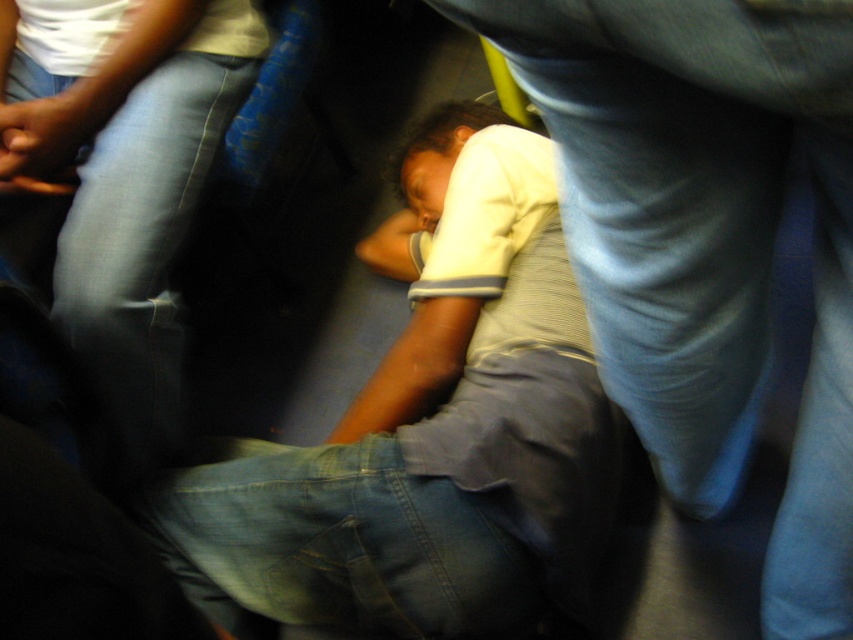
Question: Does white cotton shirt at center have a greater width compared to gray striped shirt at center?

Choices:
 (A) yes
 (B) no

Answer: (A)

Question: Does white cotton shirt at center have a lesser width compared to gray striped shirt at center?

Choices:
 (A) no
 (B) yes

Answer: (A)

Question: Is white cotton shirt at center to the right of gray striped shirt at center from the viewer's perspective?

Choices:
 (A) no
 (B) yes

Answer: (A)